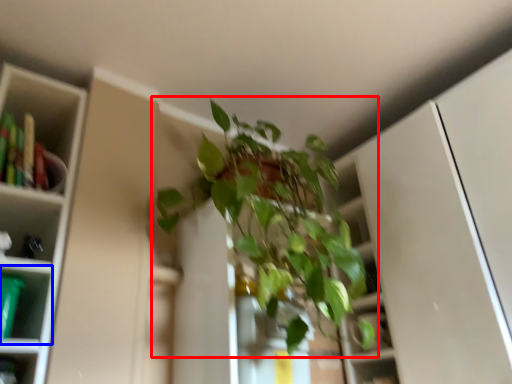
Question: Which of the following is the farthest to the observer, houseplant (highlighted by a red box) or shelf (highlighted by a blue box)?

Choices:
 (A) houseplant
 (B) shelf

Answer: (B)